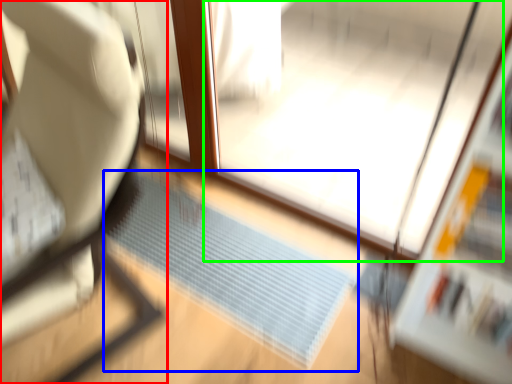
Question: Based on their relative distances, which object is farther from furniture (highlighted by a red box)? Choose from doormat (highlighted by a blue box) and screen door (highlighted by a green box).

Choices:
 (A) doormat
 (B) screen door

Answer: (B)